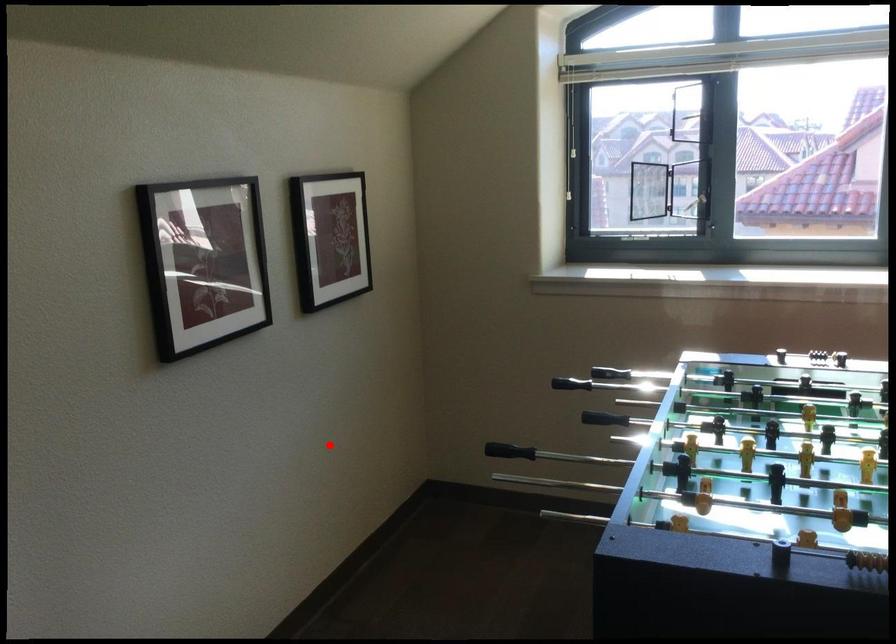
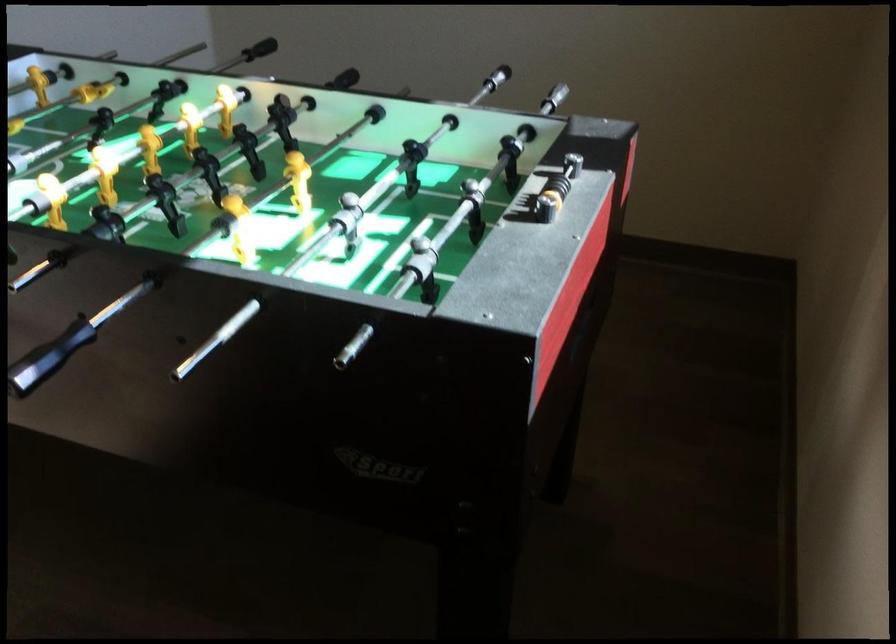
In the second image, find the point that corresponds to the highlighted location in the first image.

(554, 98)